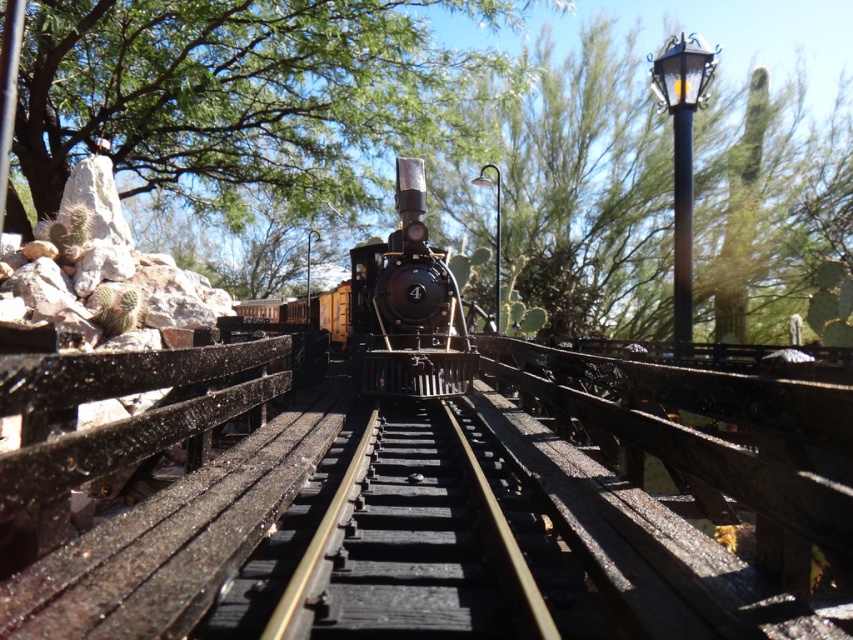
Question: Can you confirm if green leafy tree at upper center is positioned to the right of shiny black locomotive at center?

Choices:
 (A) yes
 (B) no

Answer: (A)

Question: Can you confirm if green leafy tree at upper center is positioned to the left of black metal train track at center?

Choices:
 (A) no
 (B) yes

Answer: (B)

Question: Can you confirm if black metal train track at center is positioned above shiny black locomotive at center?

Choices:
 (A) yes
 (B) no

Answer: (B)

Question: Considering the real-world distances, which object is closest to the shiny black locomotive at center?

Choices:
 (A) green leafy tree at upper center
 (B) black metal train track at center

Answer: (B)

Question: Which point is closer to the camera taking this photo?

Choices:
 (A) 215,195
 (B) 386,492

Answer: (B)

Question: Which object is farther from the camera taking this photo?

Choices:
 (A) black metal train track at center
 (B) green leafy tree at upper center

Answer: (B)